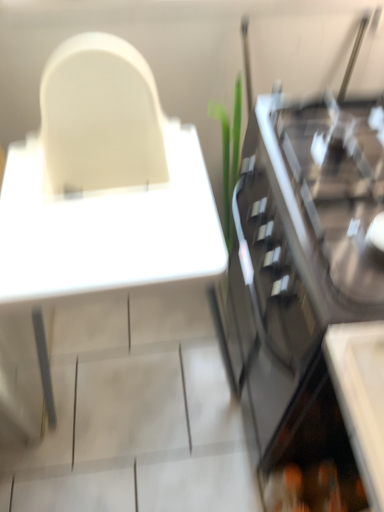
Question: Is white plastic table at upper left to the left or to the right of black glass cabinet at right in the image?

Choices:
 (A) left
 (B) right

Answer: (A)

Question: Based on their sizes in the image, would you say white plastic table at upper left is bigger or smaller than black glass cabinet at right?

Choices:
 (A) big
 (B) small

Answer: (A)

Question: Is white plastic table at upper left inside the boundaries of black glass cabinet at right, or outside?

Choices:
 (A) outside
 (B) inside

Answer: (A)

Question: Would you say black glass cabinet at right is to the left or to the right of white plastic table at upper left in the picture?

Choices:
 (A) right
 (B) left

Answer: (A)

Question: From a real-world perspective, is black glass cabinet at right above or below white plastic table at upper left?

Choices:
 (A) above
 (B) below

Answer: (B)

Question: Choose the correct answer: Is black glass cabinet at right inside white plastic table at upper left or outside it?

Choices:
 (A) outside
 (B) inside

Answer: (A)

Question: Is point (291, 160) closer or farther from the camera than point (100, 237)?

Choices:
 (A) closer
 (B) farther

Answer: (A)